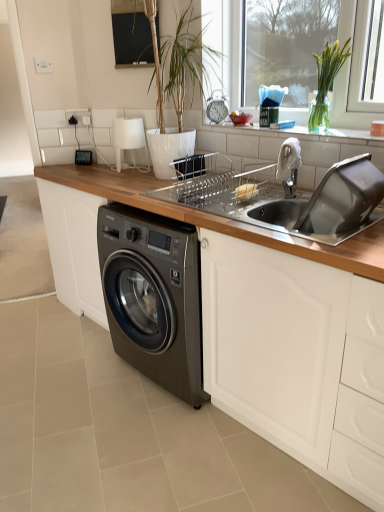
Question: In the image, is silver metallic faucet at upper right positioned in front of or behind white glossy window sill at upper center?

Choices:
 (A) behind
 (B) front

Answer: (B)

Question: Considering the relative positions of silver metallic faucet at upper right and white glossy window sill at upper center in the image provided, is silver metallic faucet at upper right to the left or to the right of white glossy window sill at upper center?

Choices:
 (A) left
 (B) right

Answer: (A)

Question: Considering the real-world distances, which object is farthest from the green glass vase at upper right?

Choices:
 (A) wooden at lower left
 (B) silver metallic faucet at upper right
 (C) black glass window screen at upper center
 (D) metallic silver clock at center
 (E) stainless steel sink at upper right

Answer: (A)

Question: Which object is the closest to the silver metallic faucet at upper right?

Choices:
 (A) black glass window screen at upper center
 (B) stainless steel sink at upper right
 (C) green glass vase at upper right
 (D) white glossy window sill at upper center
 (E) wooden at lower left

Answer: (D)